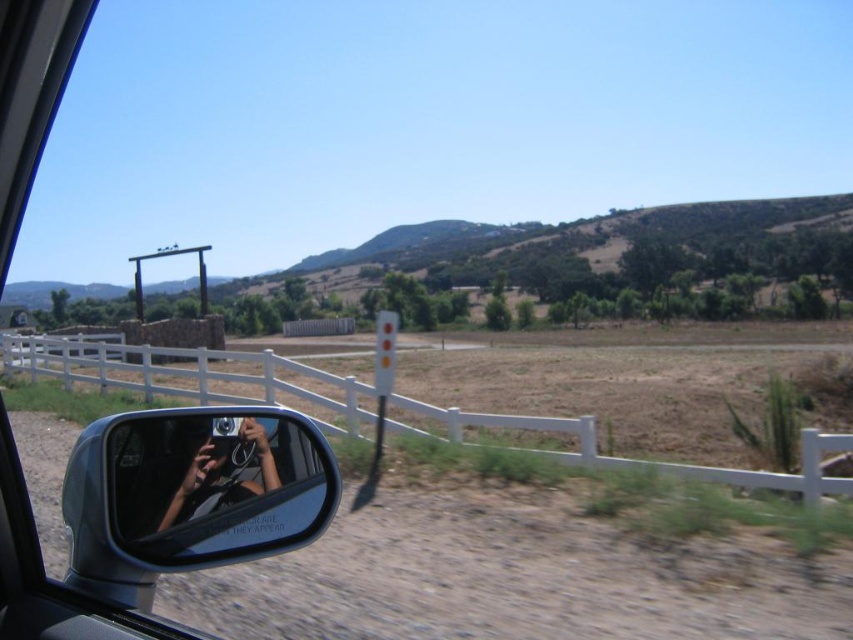
You are driving and looking at the rearview mirror. You see two points marked on the road ahead. The first point is at coordinates point (142, 392) and the second is at point (252, 419). Which point is closer to your current position?

Point (252, 419) is closer to your current position because point (142, 392) is behind it.

You are driving a car with a 5.5 inch wide rearview mirror mounted on the windshield. You notice the clear glass mirror at lower left and the matte black camera at lower center in your view. Can the rearview mirror fit between them without overlapping?

The distance between the clear glass mirror at lower left and the matte black camera at lower center is 4.41 inches. Since the rearview mirror is 5.5 inches wide, it cannot fit between them as the space is narrower than the mirror.

You are driving a car and want to take a photo of the white wooden fence at lower right using the matte black camera at lower center. Since the fence is larger, will you need to adjust the camera angle to capture the entire fence in the photo?

The white wooden fence at lower right is bigger than the matte black camera at lower center, so you will need to adjust the camera angle to capture the entire fence in the photo.